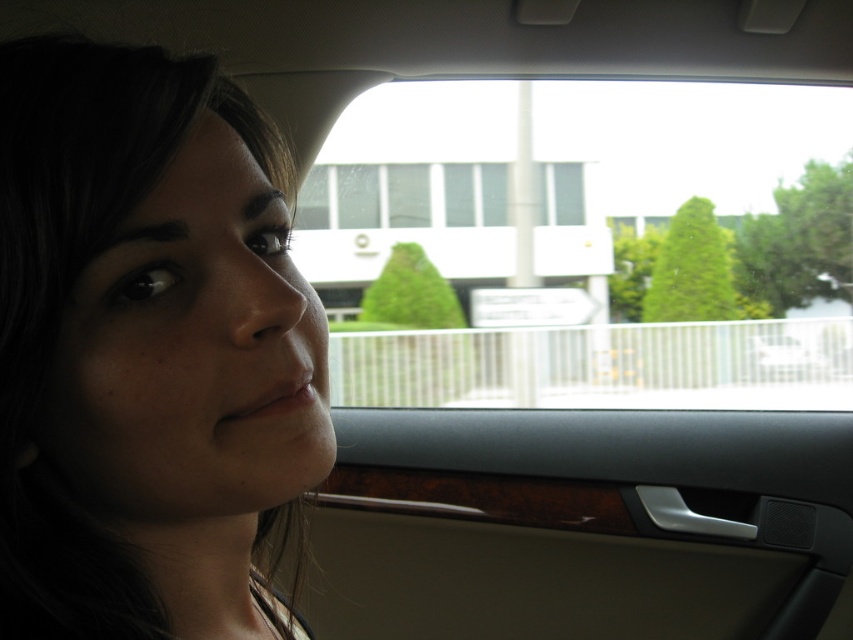
You are a passenger in a car and looking at the matte skin at center and transparent glass at upper center. Which object takes up more space in your view?

The transparent glass at upper center takes up more space in your view because the matte skin at center occupies less space than it.

You are a passenger in a car and want to see the signpost outside. Which object, the matte skin at center or the transparent glass at upper center, would allow you to have a better view of the signpost?

The transparent glass at upper center would provide a better view of the signpost since it is taller than the matte skin at center, allowing you to see over the matte skin at center.

You are a passenger in a car and notice two objects in your view. One is the matte skin at center and the other is the transparent glass at upper center. Which object is closer to you based on their positions?

The matte skin at center is positioned under the transparent glass at upper center, so the transparent glass at upper center is closer to you.